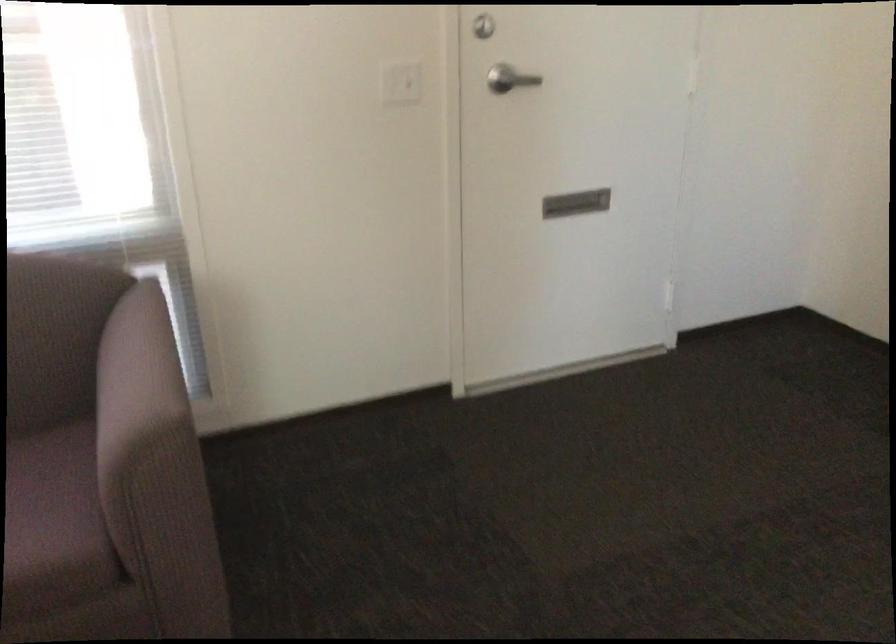
Where is `brown sofa armrest`? brown sofa armrest is located at coordinates (136, 381).